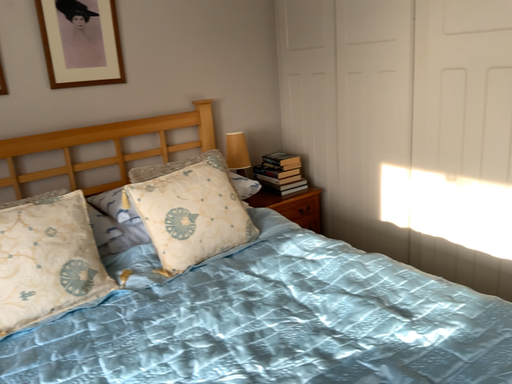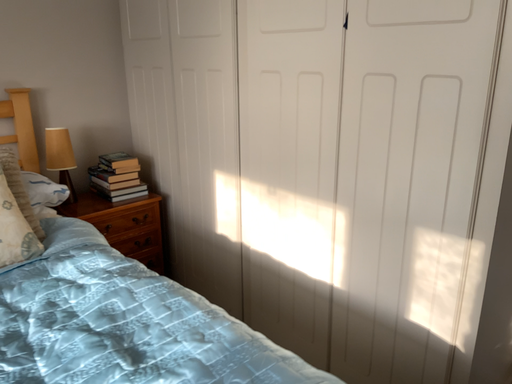
Question: Which way did the camera rotate in the video?

Choices:
 (A) rotated right
 (B) rotated left

Answer: (A)